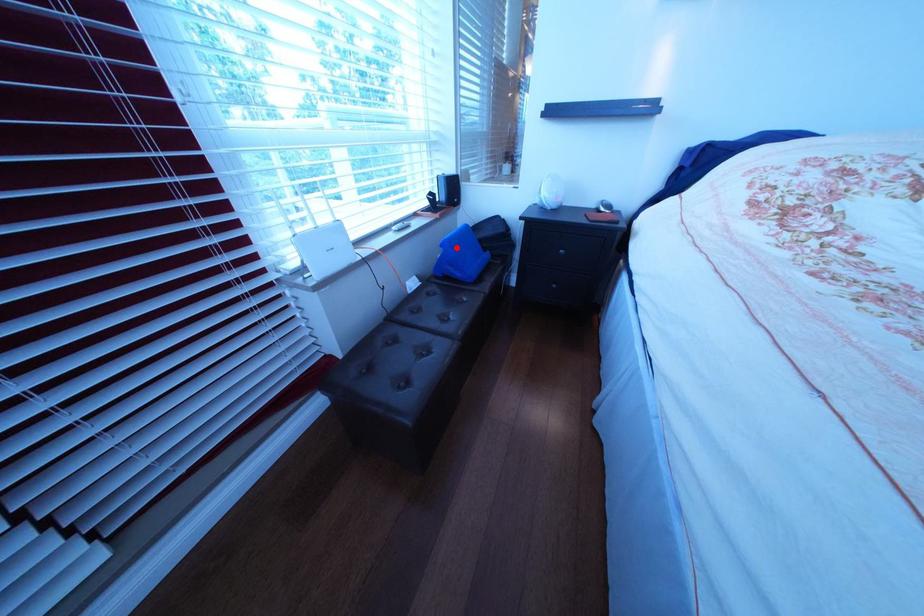
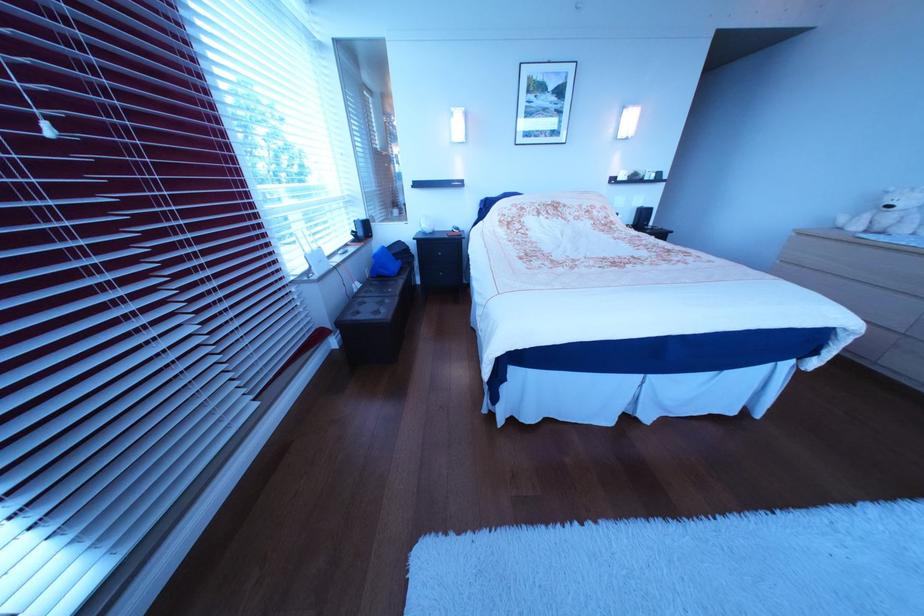
Locate, in the second image, the point that corresponds to the highlighted location in the first image.

(388, 260)